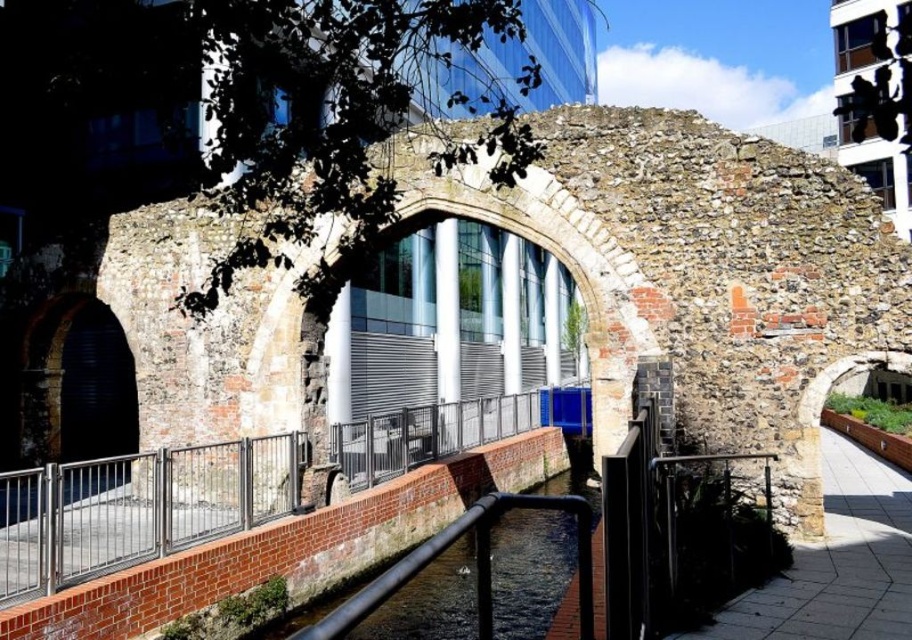
Can you confirm if stainless steel railing at lower center is shorter than smooth stone path at lower right?

Incorrect, stainless steel railing at lower center's height does not fall short of smooth stone path at lower right's.

Consider the image. Who is more distant from viewer, (x=195, y=474) or (x=862, y=624)?

The point (x=195, y=474) is more distant.

Image resolution: width=912 pixels, height=640 pixels. What are the coordinates of `stainless steel railing at lower center` in the screenshot? It's located at (136, 508).